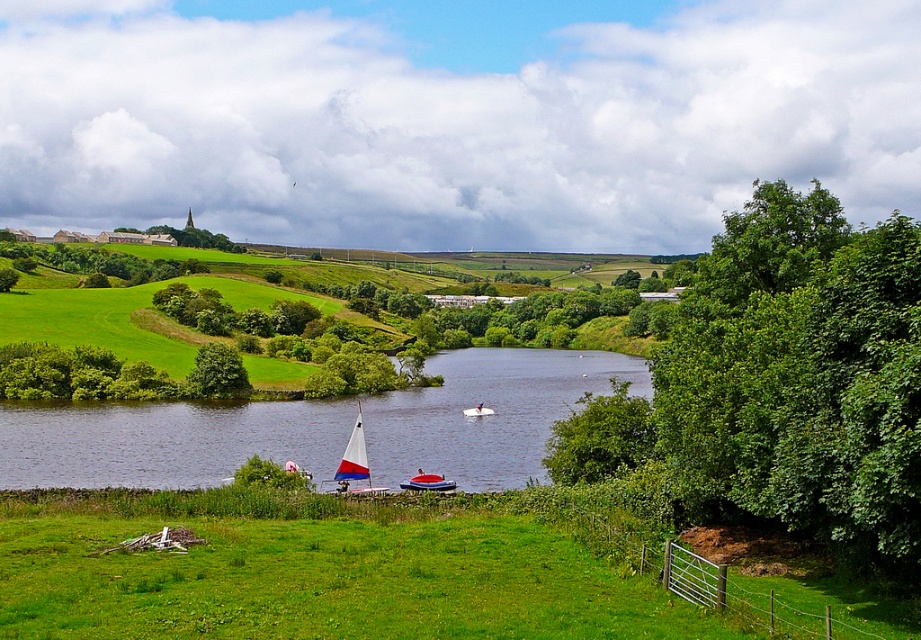
Does point (404, 484) come behind point (476, 416)?

That is False.

Where is `blue plastic boat at center`? The image size is (921, 640). blue plastic boat at center is located at coordinates (427, 483).

Which is more to the left, green leafy tree at right or green leafy tree at center-left?

green leafy tree at center-left is more to the left.

Is point (855, 307) closer to viewer compared to point (228, 365)?

Yes.

Locate an element on the screen. This screenshot has width=921, height=640. green leafy tree at right is located at coordinates (800, 376).

Does green leafy tree at center-left appear on the left side of blue plastic boat at center?

Indeed, green leafy tree at center-left is positioned on the left side of blue plastic boat at center.

Who is positioned more to the right, green leafy tree at center-left or blue plastic boat at center?

Positioned to the right is blue plastic boat at center.

Which is behind, point (226, 365) or point (417, 486)?

The point (226, 365) is behind.

Find the location of `green leafy tree at center-left`. green leafy tree at center-left is located at coordinates (217, 372).